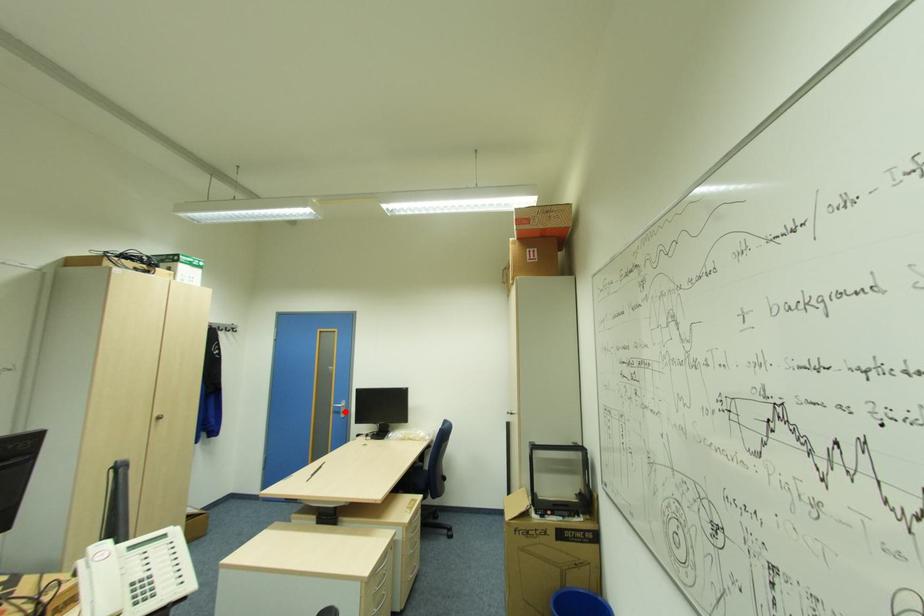
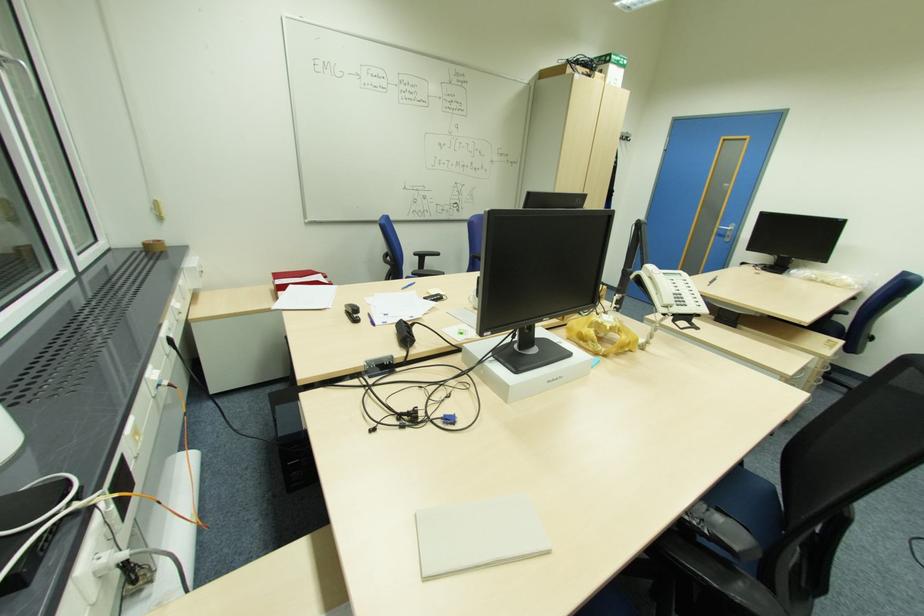
Find the pixel in the second image that matches the highlighted location in the first image.

(732, 236)